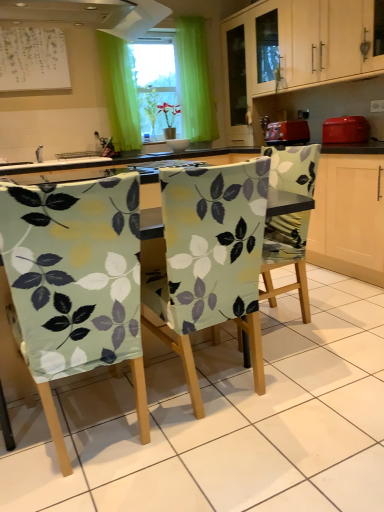
Question: From a real-world perspective, is light green fabric-covered chair at center, the 2th chair positioned from the right, above or below white paper at upper left?

Choices:
 (A) below
 (B) above

Answer: (A)

Question: Considering their positions, is light green fabric-covered chair at center, the second chair viewed from the left, located in front of or behind white paper at upper left?

Choices:
 (A) behind
 (B) front

Answer: (B)

Question: Based on their relative distances, which object is nearer to the white glossy sink at upper left?

Choices:
 (A) matte red toaster at right, the first appliance when ordered from right to left
 (B) matte red toaster at center, which appears as the 2th appliance when viewed from the right
 (C) light green fabric-covered chair at center, the third chair positioned from the left
 (D) green fabric curtain at upper center
 (E) light green fabric-covered chair at center, the 2th chair positioned from the right

Answer: (D)

Question: Which of these objects is positioned closest to the light green fabric-covered chair at center, which ranks as the first chair in left-to-right order?

Choices:
 (A) white paper at upper left
 (B) light wood cabinet at upper center
 (C) matte red toaster at center, which appears as the 2th appliance when viewed from the right
 (D) light green fabric-covered chair at center, the 2th chair positioned from the right
 (E) light green fabric-covered chair at center, arranged as the 1th chair when viewed from the right

Answer: (D)